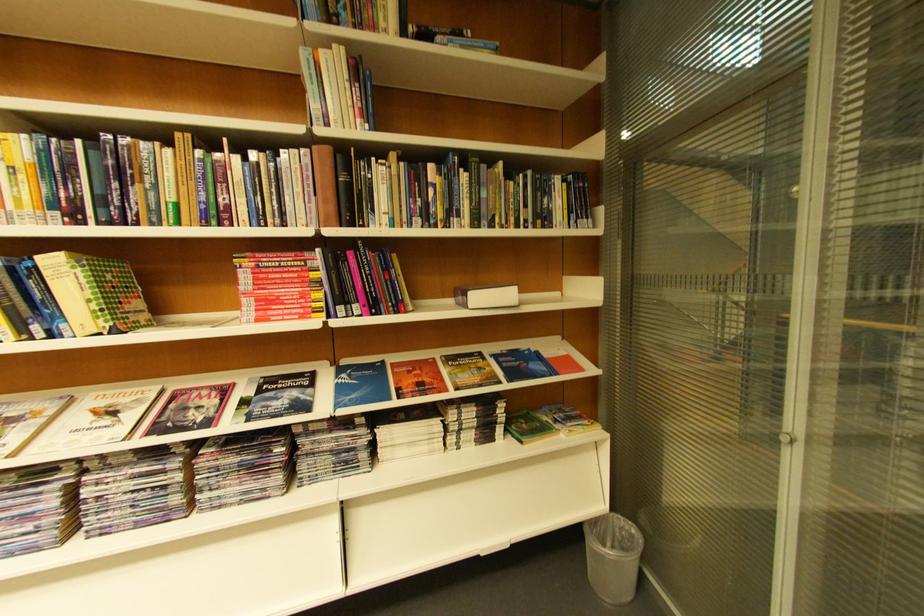
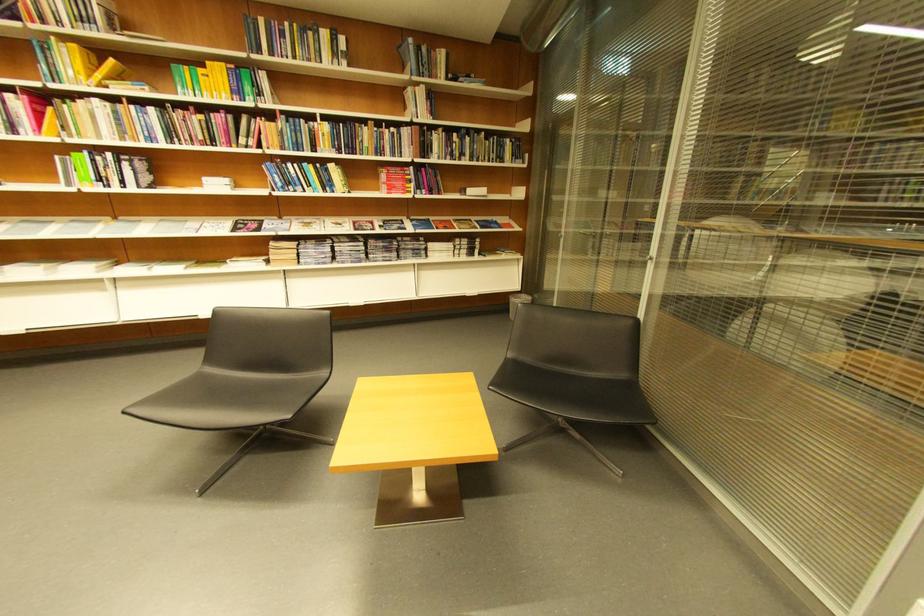
Find the pixel in the second image that matches [281,262] in the first image.

(403, 172)